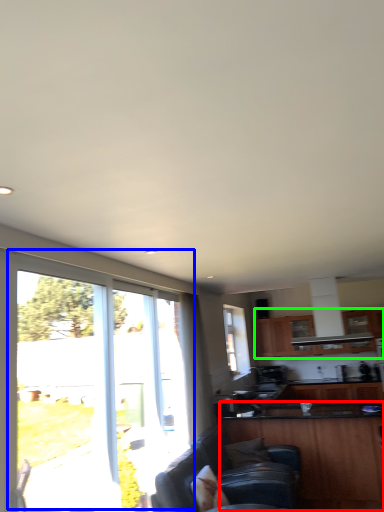
Question: Estimate the real-world distances between objects in this image. Which object is farther from cabinetry (highlighted by a red box), window (highlighted by a blue box) or cabinetry (highlighted by a green box)?

Choices:
 (A) window
 (B) cabinetry

Answer: (A)